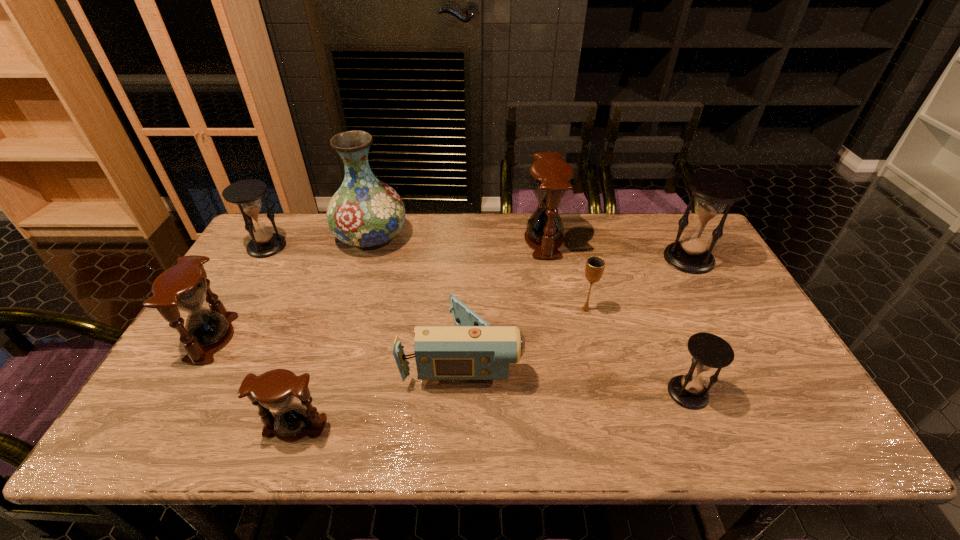
I want to click on vacant space that satisfies the following two spatial constraints: 1. on the front side of the vase; 2. on the left side of the chalice, so click(x=349, y=309).